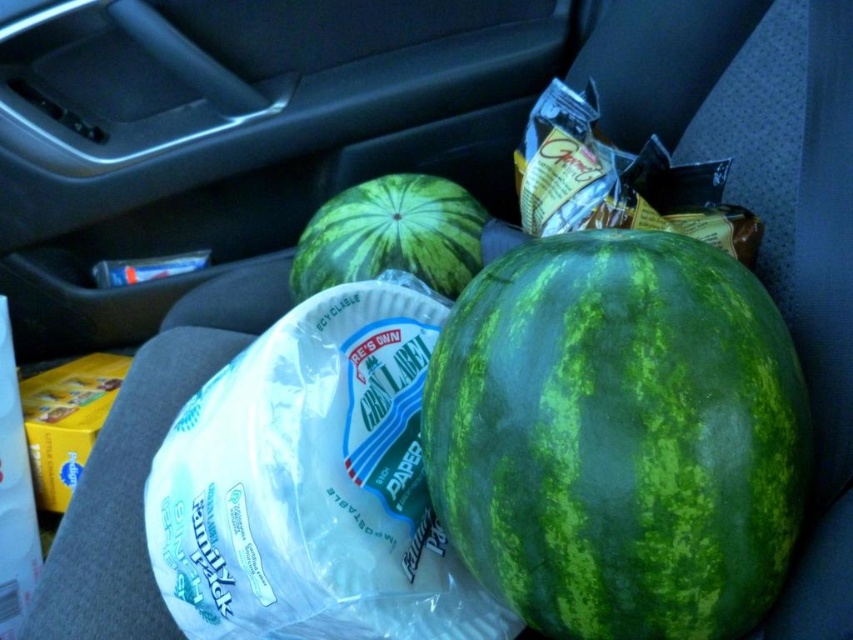
Does green textured melon at center appear over green textured watermelon at center?

No.

Does green textured melon at center have a lesser height compared to green textured watermelon at center?

In fact, green textured melon at center may be taller than green textured watermelon at center.

Identify the location of green textured melon at center. This screenshot has height=640, width=853. pyautogui.click(x=619, y=436).

Where is `green textured melon at center`? The width and height of the screenshot is (853, 640). green textured melon at center is located at coordinates (619, 436).